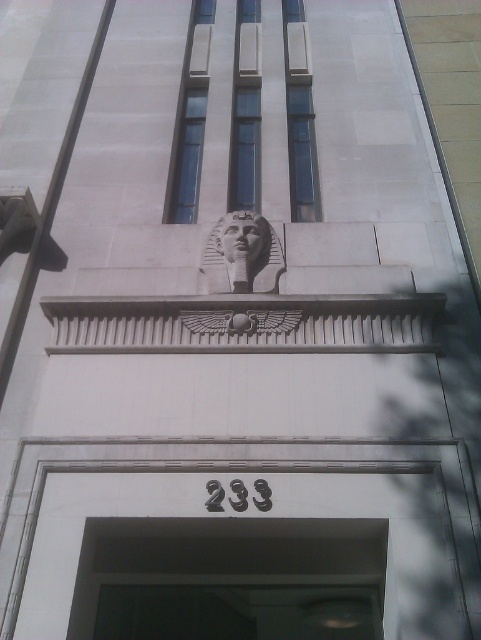
Between black glass door at center and white stone pharaoh head at center, which one has less height?

With less height is white stone pharaoh head at center.

Is point (285, 637) closer to viewer compared to point (241, 236)?

No.

Is point (281, 550) positioned behind point (255, 272)?

That is False.

The image size is (481, 640). In order to click on black glass door at center in this screenshot , I will do `click(229, 579)`.